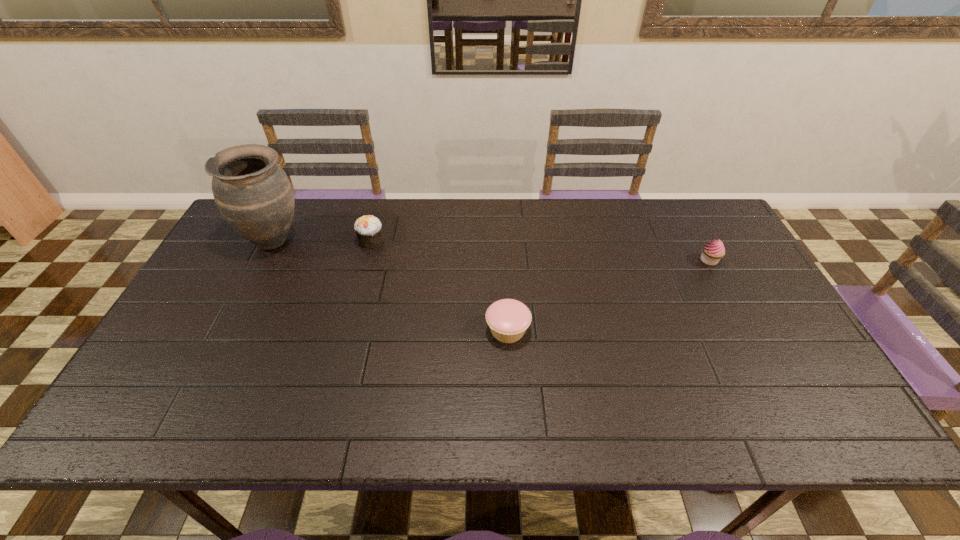
Locate an element on the screen. free space located on the left of the farthest cupcake is located at coordinates (263, 240).

The width and height of the screenshot is (960, 540). Identify the location of vacant space located 0.280m on the right of the shortest cupcake. (638, 330).

Where is `urn present at the far edge`? urn present at the far edge is located at coordinates (253, 193).

The image size is (960, 540). What are the coordinates of `cupcake located at the far edge` in the screenshot? It's located at coord(368,228).

At what (x,y) coordinates should I click in order to perform the action: click on object present at the left edge. Please return your answer as a coordinate pair (x, y). Looking at the image, I should click on (253, 193).

This screenshot has height=540, width=960. I want to click on object that is positioned at the right edge, so click(x=712, y=252).

What are the coordinates of `object positioned at the far left corner` in the screenshot? It's located at (253, 193).

The width and height of the screenshot is (960, 540). Find the location of `vacant area at the far edge`. vacant area at the far edge is located at coordinates (469, 207).

In the image, there is a desktop. In order to click on vacant space at the near edge in this screenshot , I will do `click(566, 430)`.

This screenshot has height=540, width=960. In the image, there is a desktop. Identify the location of vacant space at the right edge. (813, 397).